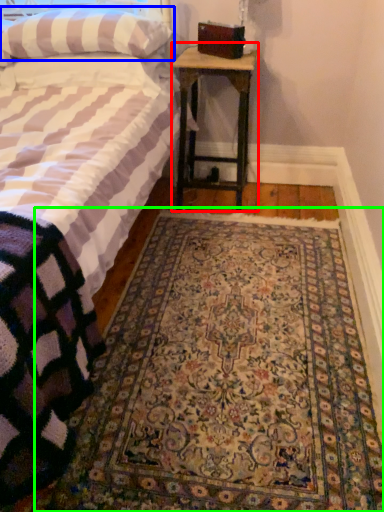
Question: Based on their relative distances, which object is nearer to nightstand (highlighted by a red box)? Choose from pillow (highlighted by a blue box) and mat (highlighted by a green box).

Choices:
 (A) pillow
 (B) mat

Answer: (A)